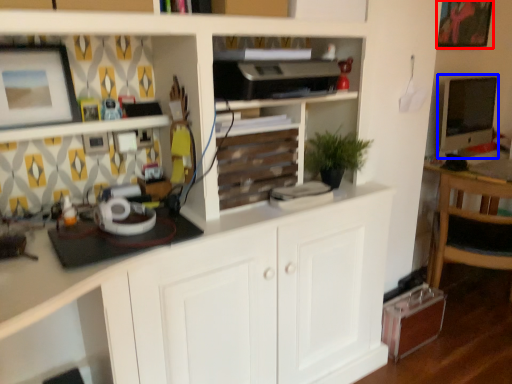
Question: Which object is further to the camera taking this photo, picture frame (highlighted by a red box) or computer monitor (highlighted by a blue box)?

Choices:
 (A) picture frame
 (B) computer monitor

Answer: (B)